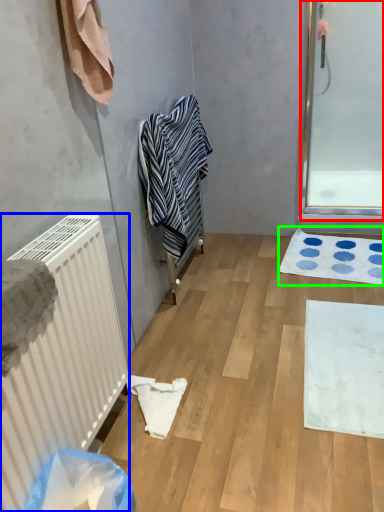
Question: Estimate the real-world distances between objects in this image. Which object is closer to screen door (highlighted by a red box), radiator (highlighted by a blue box) or bath mat (highlighted by a green box)?

Choices:
 (A) radiator
 (B) bath mat

Answer: (B)